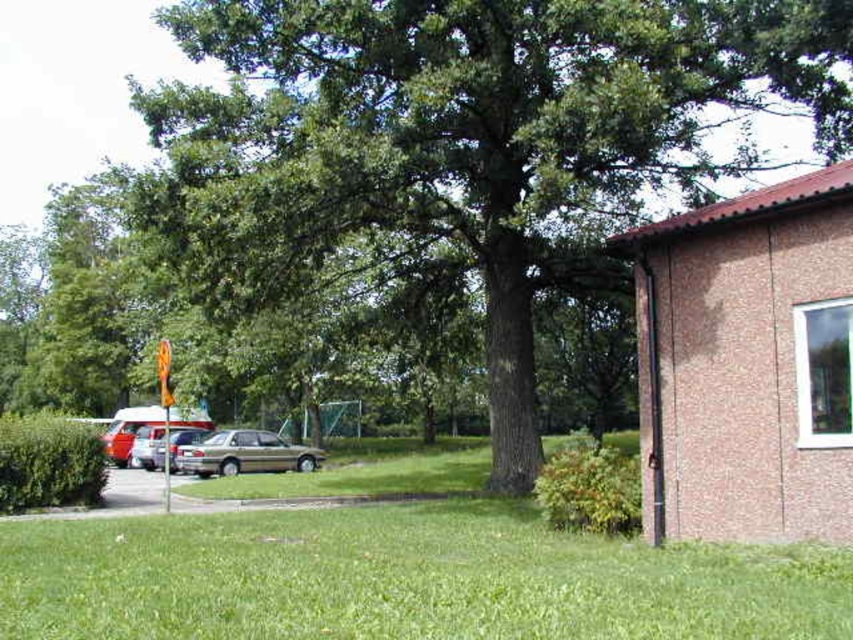
You are standing in the outdoor scene and want to take a photo of the green leafy tree at center. If you move 0.1 units to the right in the image coordinate system, will the tree still be in the frame?

The green leafy tree at center is located at point (466, 141). Moving 0.1 units to the right would place you at 0.322 on the x axis. Since the tree is still within the image boundaries, it will remain in the frame.

You are standing at the center of the image and want to walk towards the point that is closer to you. Which point should you walk towards, point (x=212, y=435) or point (x=157, y=456)?

Point (x=212, y=435) is in front of point (x=157, y=456), so you should walk towards point (x=212, y=435) as it is closer to you.